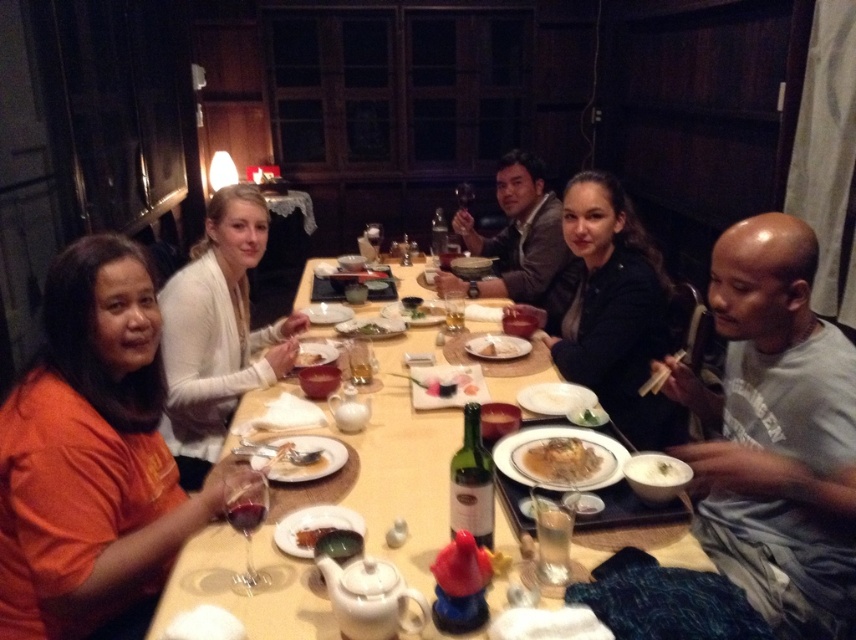
Question: Among these points, which one is farthest from the camera?

Choices:
 (A) (556, 476)
 (B) (131, 244)

Answer: (A)

Question: Observing the image, what is the correct spatial positioning of golden crispy rice at center in reference to matte ceramic bowl at center?

Choices:
 (A) left
 (B) right

Answer: (B)

Question: Among these points, which one is farthest from the camera?

Choices:
 (A) (473, 228)
 (B) (321, 531)
 (C) (660, 467)

Answer: (A)

Question: Can you confirm if white sweater at upper center is positioned to the left of smooth brown jacket at center?

Choices:
 (A) yes
 (B) no

Answer: (A)

Question: Which point is farther to the camera?

Choices:
 (A) (519, 342)
 (B) (307, 540)
 (C) (562, 445)

Answer: (A)

Question: Is wooden table at center thinner than dark brown leather jacket at center?

Choices:
 (A) no
 (B) yes

Answer: (A)